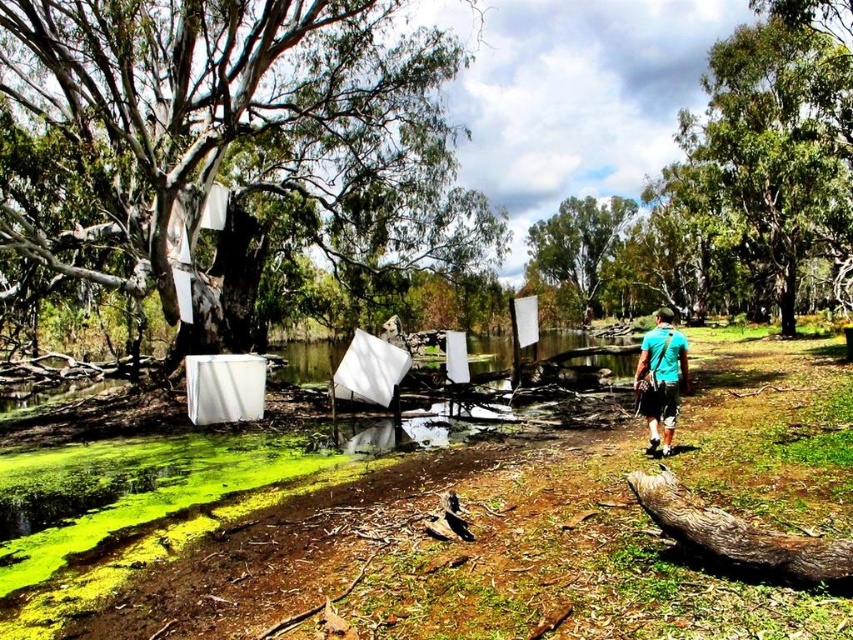
You are an artist planning to paint the scene. You need to decide the placement of the smooth bark tree at left and the green leafy tree at upper right in your painting. According to the scene, which tree should be placed on the left side of the other?

The smooth bark tree at left should be placed on the left side of the green leafy tree at upper right because the smooth bark tree at left is positioned on the left side of green leafy tree at upper right.

You are standing in the outdoor scene and want to walk towards the smooth bark tree at left and the green leafy tree at upper right. Which tree will you reach first?

You will reach the smooth bark tree at left first because it is closer to you than the green leafy tree at upper right.